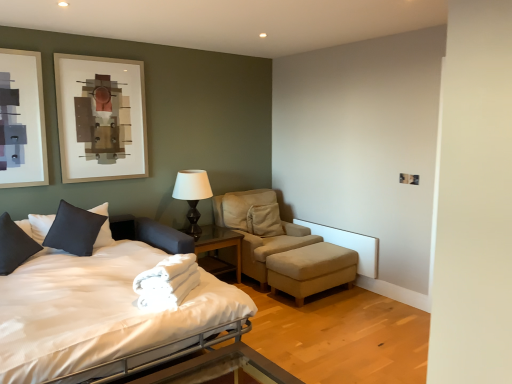
Image resolution: width=512 pixels, height=384 pixels. In order to click on metallic silver bed frame at lower center in this screenshot , I will do `click(222, 368)`.

Is glass/metal nightstand at center with beige fabric chair at center?

No, glass/metal nightstand at center is not making contact with beige fabric chair at center.

Considering the sizes of glass/metal nightstand at center and beige fabric chair at center in the image, is glass/metal nightstand at center taller or shorter than beige fabric chair at center?

Clearly, glass/metal nightstand at center is shorter compared to beige fabric chair at center.

From a real-world perspective, is glass/metal nightstand at center below beige fabric chair at center?

→ Yes, from a real-world perspective, glass/metal nightstand at center is beneath beige fabric chair at center.

Looking at this image, could you tell me if glass/metal nightstand at center is turned towards beige fabric chair at center?

No.

Is white satin bed at left closer to camera compared to matte black pillow at left, which appears as the 2th pillow when viewed from the right?

Yes, it is.

This screenshot has height=384, width=512. Find the location of `bed located underneath the matte black pillow at left, which appears as the 2th pillow when viewed from the right (from a real-world perspective)`. bed located underneath the matte black pillow at left, which appears as the 2th pillow when viewed from the right (from a real-world perspective) is located at coordinates 104,307.

Based on their positions, is white satin bed at left located to the left or right of beige fabric chair at center?

From the image, it's evident that white satin bed at left is to the left of beige fabric chair at center.

Is white satin bed at left placed right next to beige fabric chair at center?

No, white satin bed at left is not beside beige fabric chair at center.

Relative to beige fabric chair at center, is white satin bed at left in front or behind?

In the image, white satin bed at left appears in front of beige fabric chair at center.

Would you say white satin bed at left is inside or outside beige fabric chair at center?

white satin bed at left is located beyond the bounds of beige fabric chair at center.

Is matte black pillow at left, which appears as the 2th pillow when viewed from the right, inside matte black table lamp at center?

Definitely not — matte black pillow at left, which appears as the 2th pillow when viewed from the right, is not inside matte black table lamp at center.

From a real-world perspective, is matte black table lamp at center under matte black pillow at left, arranged as the first pillow when viewed from the left?

No, from a real-world perspective, matte black table lamp at center is not under matte black pillow at left, arranged as the first pillow when viewed from the left.

Can you tell me how much matte black table lamp at center and matte black pillow at left, which appears as the 2th pillow when viewed from the right, differ in facing direction?

The angle between the facing direction of matte black table lamp at center and the facing direction of matte black pillow at left, which appears as the 2th pillow when viewed from the right, is 0.778 degrees.

How much distance is there between matte black table lamp at center and matte black pillow at left, which appears as the 2th pillow when viewed from the right?

matte black table lamp at center is 4.92 feet away from matte black pillow at left, which appears as the 2th pillow when viewed from the right.

Is glass/metal nightstand at center surrounded by matte black pillow at left, arranged as the first pillow when viewed from the left?

Definitely not — glass/metal nightstand at center is not inside matte black pillow at left, arranged as the first pillow when viewed from the left.

From a real-world perspective, which object stands above the other?

matte black pillow at left, arranged as the first pillow when viewed from the left, from a real-world perspective.

Is matte black pillow at left, which appears as the 2th pillow when viewed from the right, facing towards glass/metal nightstand at center?

No, matte black pillow at left, which appears as the 2th pillow when viewed from the right, does not turn towards glass/metal nightstand at center.

From the image's perspective, is matte black pillow at left, arranged as the first pillow when viewed from the left, located above glass/metal nightstand at center?

Yes, from the image's perspective, matte black pillow at left, arranged as the first pillow when viewed from the left, is above glass/metal nightstand at center.

From the image's perspective, is white satin bed at left located above white soft towel at bed?

Incorrect, from the image's perspective, white satin bed at left is lower than white soft towel at bed.

Is point (240, 324) positioned behind point (169, 258)?

No, it is in front of (169, 258).

Identify the location of bed below the white soft towel at bed (from a real-world perspective). This screenshot has height=384, width=512. (104, 307).

In terms of size, does white satin bed at left appear bigger or smaller than white soft towel at bed?

In the image, white satin bed at left appears to be larger than white soft towel at bed.

You are a GUI agent. You are given a task and a screenshot of the screen. Output one action in this format:
    pyautogui.click(x=<x>, y=<y>)
    Task: Click on the table lamp to the left of white soft towel at bed
    This screenshot has width=512, height=384.
    Given the screenshot: What is the action you would take?
    pyautogui.click(x=192, y=196)

Relative to matte black table lamp at center, is white soft towel at bed in front or behind?

Visually, white soft towel at bed is located in front of matte black table lamp at center.

This screenshot has height=384, width=512. Find the location of `nightstand to the left of beige fabric chair at center`. nightstand to the left of beige fabric chair at center is located at coordinates (220, 243).

From the image's perspective, count 1st pillows upward from the white satin bed at left and point to it. Please provide its 2D coordinates.

[(14, 245)]

From the image, which object appears to be nearer to white soft towel at bed, dark gray fabric pillow at left, the 2th pillow in the left-to-right sequence, or matte black pillow at left, which appears as the 2th pillow when viewed from the right?

matte black pillow at left, which appears as the 2th pillow when viewed from the right, is closer to white soft towel at bed.

Based on their spatial positions, is glass/metal nightstand at center or beige fabric chair at center further from matte black table lamp at center?

Among the two, beige fabric chair at center is located further to matte black table lamp at center.

Considering their positions, is white soft towel at bed positioned further to glass/metal nightstand at center than metallic silver bed frame at lower center?

metallic silver bed frame at lower center.

From the picture: Considering their positions, is white soft towel at bed positioned closer to glass/metal nightstand at center than white satin bed at left?

The object closer to glass/metal nightstand at center is white satin bed at left.

In the scene shown: Which object lies further to the anchor point dark gray fabric pillow at left, the 2th pillow in the left-to-right sequence, white satin bed at left or matte black pillow at left, arranged as the first pillow when viewed from the left?

white satin bed at left is positioned further to the anchor dark gray fabric pillow at left, the 2th pillow in the left-to-right sequence.

When comparing their distances from beige fabric ottoman at lower right, does metallic silver bed frame at lower center or white satin bed at left seem closer?

The object closer to beige fabric ottoman at lower right is metallic silver bed frame at lower center.

Considering their positions, is dark gray fabric pillow at left, which is counted as the 1th pillow, starting from the right, positioned closer to white satin bed at left than metallic silver bed frame at lower center?

metallic silver bed frame at lower center is positioned closer to the anchor white satin bed at left.

From the image, which object appears to be nearer to matte black pillow at left, arranged as the first pillow when viewed from the left, metallic silver bed frame at lower center or glass/metal nightstand at center?

Among the two, glass/metal nightstand at center is located nearer to matte black pillow at left, arranged as the first pillow when viewed from the left.

What are the coordinates of `chair located between white soft towel at bed and matte black table lamp at center in the depth direction` in the screenshot? It's located at 257,235.

Locate an element on the screen. table lamp between dark gray fabric pillow at left, the 2th pillow in the left-to-right sequence, and beige fabric ottoman at lower right, in the horizontal direction is located at coordinates (192, 196).

Image resolution: width=512 pixels, height=384 pixels. I want to click on blanket between matte black pillow at left, arranged as the first pillow when viewed from the left, and beige fabric ottoman at lower right, in the horizontal direction, so click(167, 282).

This screenshot has width=512, height=384. I want to click on nightstand between matte black table lamp at center and beige fabric chair at center in the horizontal direction, so click(x=220, y=243).